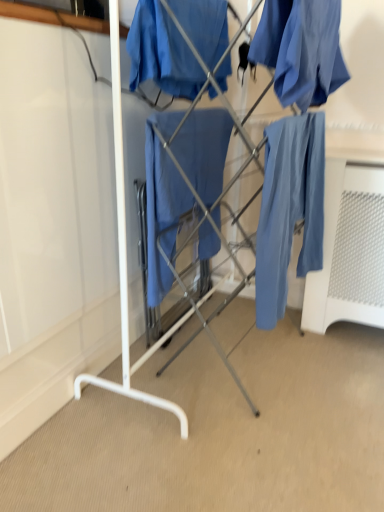
Question: Is matte blue fabric at center to the right of matte blue fabric at upper right, which ranks as the 1th clothing in right-to-left order, from the viewer's perspective?

Choices:
 (A) yes
 (B) no

Answer: (B)

Question: From a real-world perspective, is matte blue fabric at center physically below matte blue fabric at upper right, which ranks as the 1th clothing in right-to-left order?

Choices:
 (A) yes
 (B) no

Answer: (A)

Question: Considering the relative sizes of matte blue fabric at center and matte blue fabric at upper right, which ranks as the 1th clothing in right-to-left order, in the image provided, is matte blue fabric at center wider than matte blue fabric at upper right, which ranks as the 1th clothing in right-to-left order,?

Choices:
 (A) no
 (B) yes

Answer: (A)

Question: Considering the relative positions of matte blue fabric at center and matte blue fabric at upper right, marked as the second clothing in a left-to-right arrangement, in the image provided, is matte blue fabric at center to the left of matte blue fabric at upper right, marked as the second clothing in a left-to-right arrangement, from the viewer's perspective?

Choices:
 (A) yes
 (B) no

Answer: (A)

Question: Could matte blue fabric at upper right, marked as the second clothing in a left-to-right arrangement, be considered to be inside matte blue fabric at center?

Choices:
 (A) yes
 (B) no

Answer: (B)

Question: Is matte blue fabric at center positioned beyond the bounds of matte blue fabric at upper right, marked as the second clothing in a left-to-right arrangement?

Choices:
 (A) no
 (B) yes

Answer: (B)

Question: Does matte blue fabric at center have a smaller size compared to matte blue fabric at center, the first clothing from the left?

Choices:
 (A) no
 (B) yes

Answer: (A)

Question: Is matte blue fabric at center, the first clothing from the left, a part of matte blue fabric at center?

Choices:
 (A) no
 (B) yes

Answer: (A)

Question: Is matte blue fabric at center taller than matte blue fabric at center, the first clothing from the left?

Choices:
 (A) no
 (B) yes

Answer: (B)

Question: Is matte blue fabric at center positioned behind matte blue fabric at center, the 2th clothing viewed from the right?

Choices:
 (A) yes
 (B) no

Answer: (A)

Question: Would you consider matte blue fabric at center to be distant from matte blue fabric at center, the 2th clothing viewed from the right?

Choices:
 (A) yes
 (B) no

Answer: (B)

Question: Does matte blue fabric at center appear on the right side of matte blue fabric at center, the first clothing from the left?

Choices:
 (A) yes
 (B) no

Answer: (A)

Question: Does matte blue pants at right turn towards matte blue fabric at center?

Choices:
 (A) no
 (B) yes

Answer: (B)